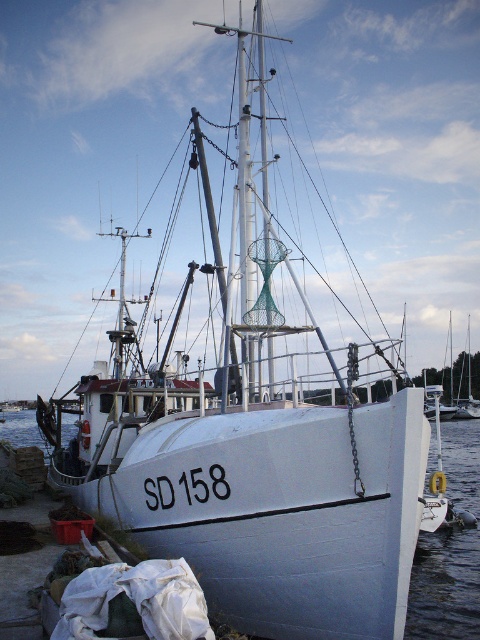
You are a sailor on the white matte boat at right and you want to check the water level. Which direction should you look to see the white smooth water at lower left?

The white smooth water at lower left is below the white matte boat at right, so you should look downward to see the white smooth water at lower left.

You are standing on the dock and want to check the depth of the water at a specific location. The coordinates given are point (x=444, y=586). Based on the scene, what is the nature of the water at that point?

The point (x=444, y=586) corresponds to white smooth water at lower left, which indicates calm water. Since the water is calm, it suggests that the depth might be sufficient for safe navigation, but the exact depth isn cannot be determined from the given information.